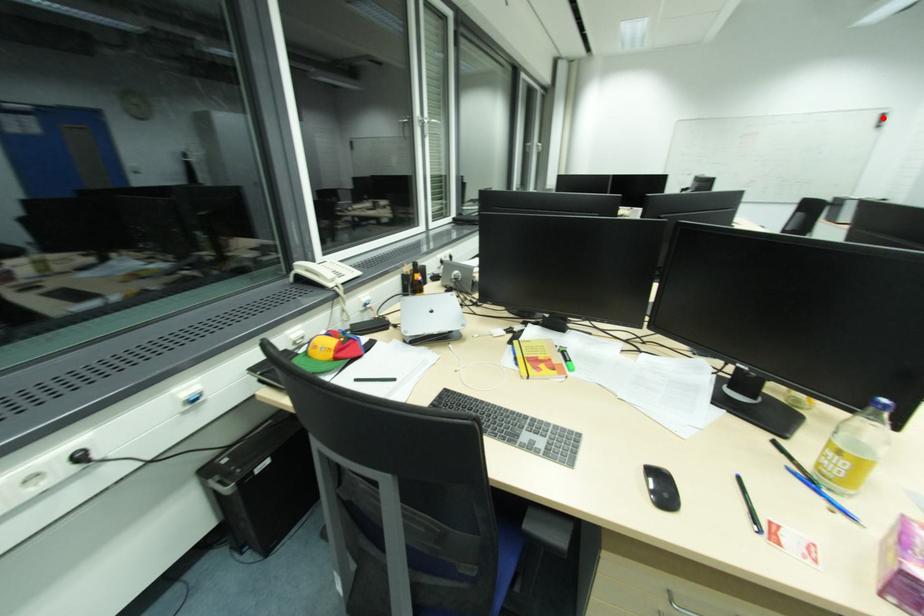
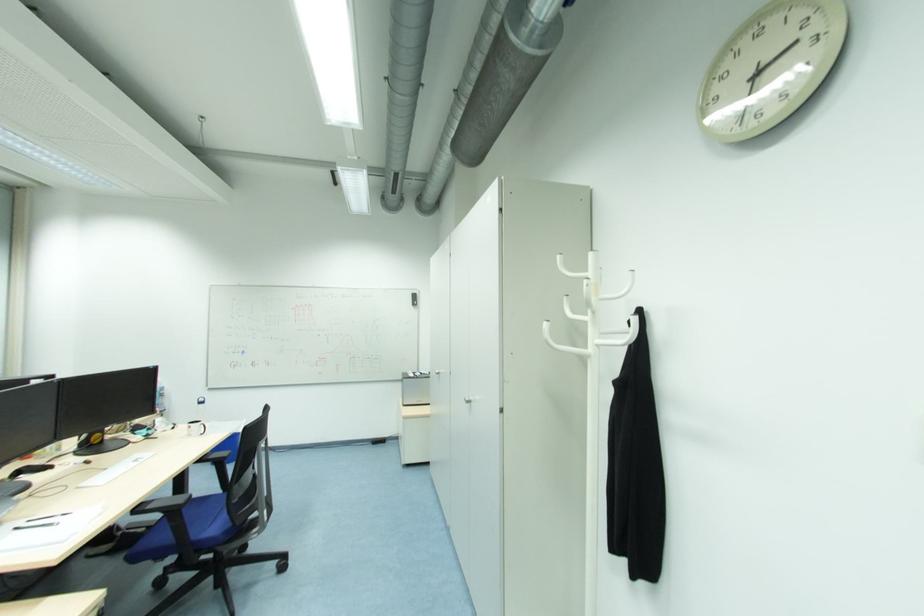
Where in the second image is the point corresponding to the highlighted location from the first image?

(417, 298)